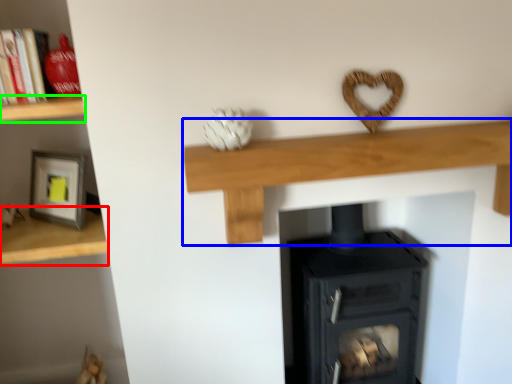
Question: Considering the real-world distances, which object is closest to shelf (highlighted by a red box)? shelf (highlighted by a blue box) or shelf (highlighted by a green box).

Choices:
 (A) shelf
 (B) shelf

Answer: (B)